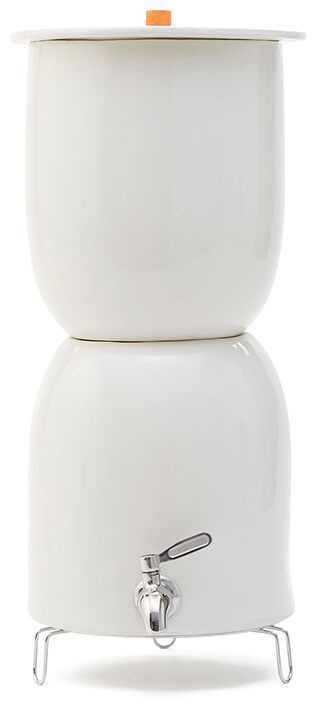
Find the location of a particular element. The width and height of the screenshot is (317, 703). faucet is located at coordinates (155, 614).